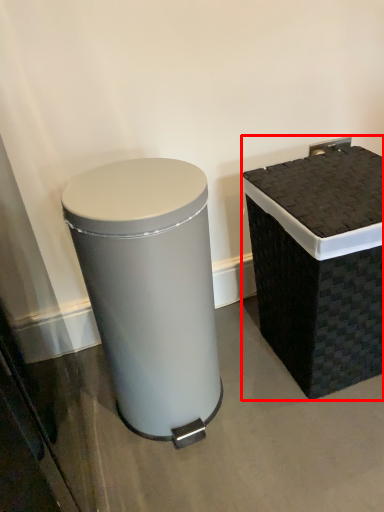
Question: From the image's perspective, what is the correct spatial relationship of waste container (annotated by the red box) in relation to waste container?

Choices:
 (A) above
 (B) below

Answer: (A)